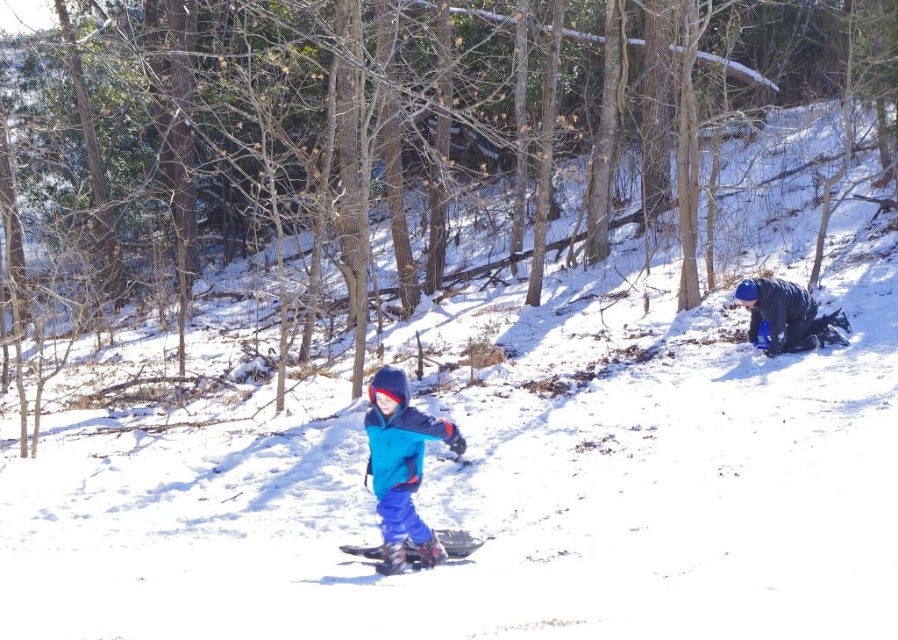
You are a photographer standing at the edge of a snowy slope. You want to take a photo that includes both the point at coordinates point (342, 545) and point (430, 538). To ensure both points are in focus, which point should you focus on first?

You should focus on point (342, 545) first because it is closer to the camera than point (430, 538). This ensures the closer point is in focus, and the farther point may also be within the depth of field.